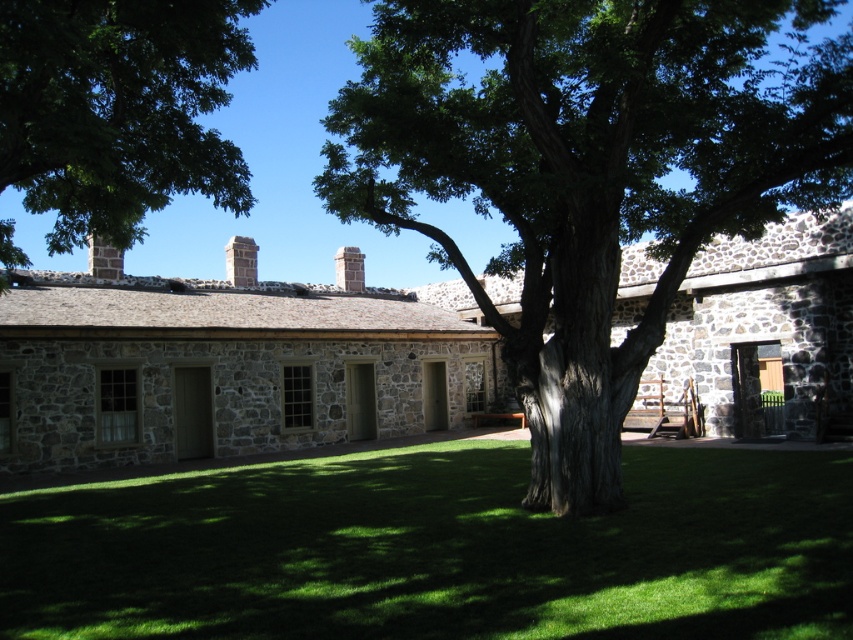
Between point (648, 512) and point (349, 250), which one is positioned in front?

Point (648, 512)

Does point (380, 500) lie in front of point (357, 268)?

Yes, it is in front of point (357, 268).

Who is more distant from viewer, (643, 483) or (361, 268)?

Positioned behind is point (361, 268).

You are a GUI agent. You are given a task and a screenshot of the screen. Output one action in this format:
    pyautogui.click(x=<x>, y=<y>)
    Task: Click on the green grass at center
    
    Given the screenshot: What is the action you would take?
    pyautogui.click(x=436, y=548)

Between green leafy tree at center and smooth stone chimney at upper center, which one appears on the left side from the viewer's perspective?

smooth stone chimney at upper center is more to the left.

Looking at this image, can you confirm if green leafy tree at center is positioned below smooth stone chimney at upper center?

No, green leafy tree at center is not below smooth stone chimney at upper center.

What do you see at coordinates (589, 173) in the screenshot?
I see `green leafy tree at center` at bounding box center [589, 173].

Where is `green leafy tree at center`? The width and height of the screenshot is (853, 640). green leafy tree at center is located at coordinates (589, 173).

Who is shorter, green grass at center or green leafy tree at upper center?

green grass at center is shorter.

Does green grass at center appear under green leafy tree at upper center?

Indeed, green grass at center is positioned under green leafy tree at upper center.

Is point (276, 531) positioned in front of point (49, 8)?

Yes, point (276, 531) is closer to viewer.

Where is `green grass at center`? green grass at center is located at coordinates (436, 548).